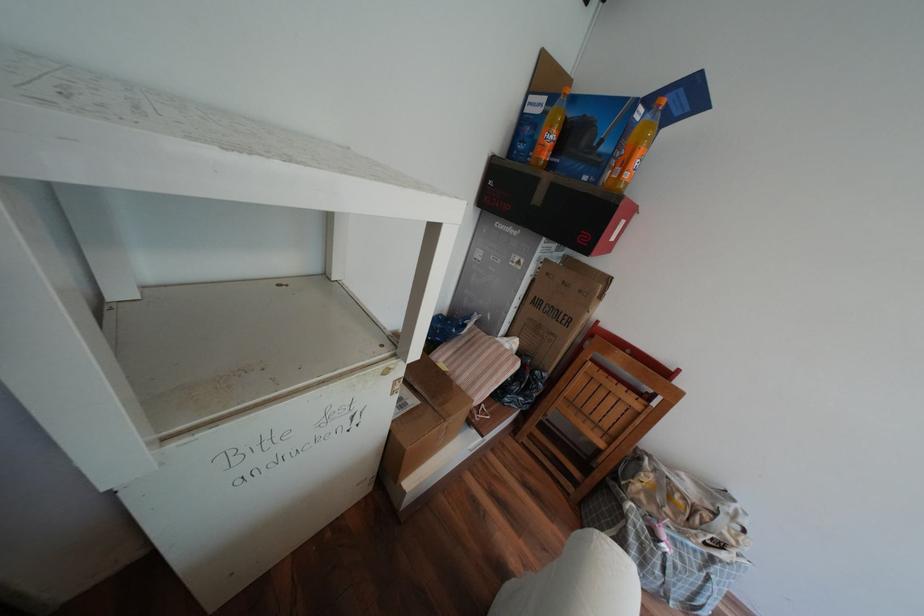
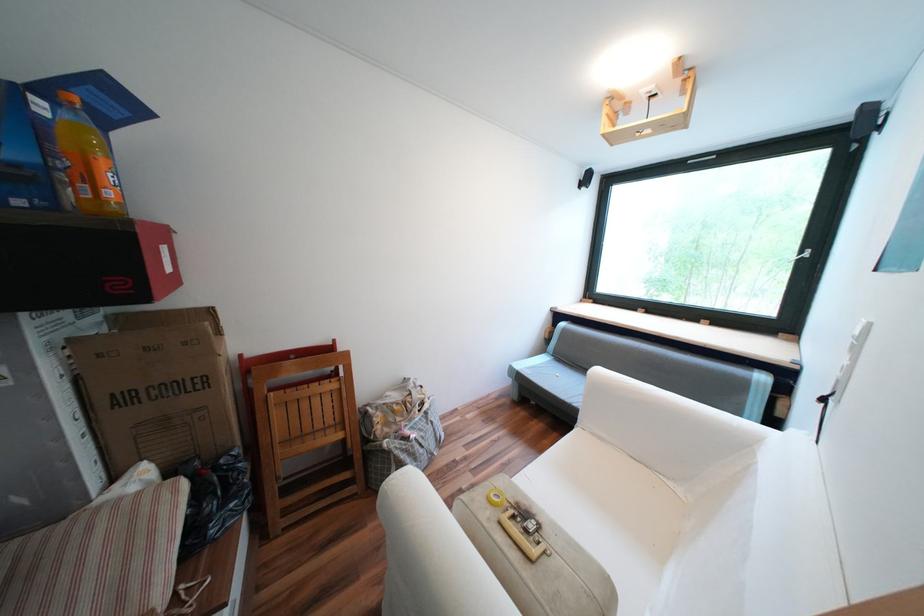
Find the pixel in the second image that matches point (651, 474) in the first image.

(383, 419)